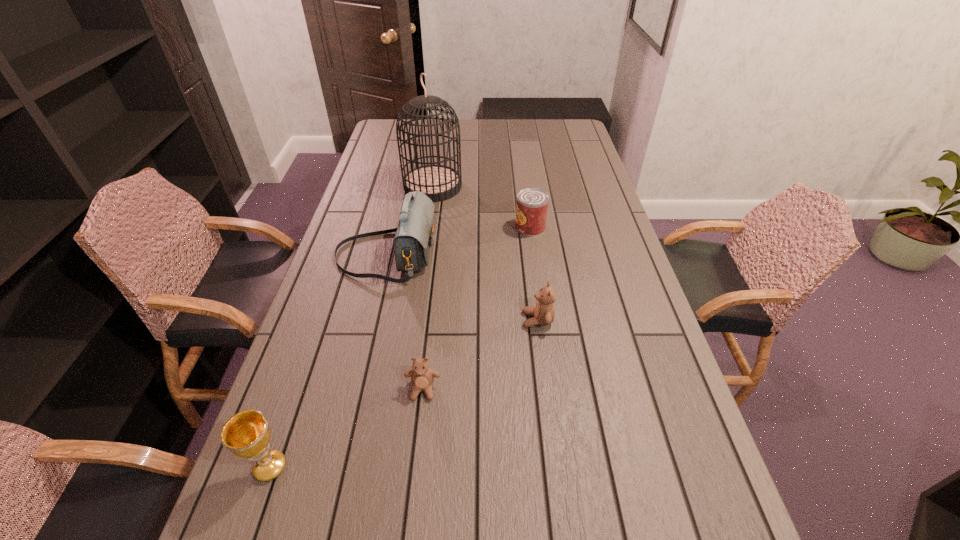
Where is `chalice positioned at the left edge`? This screenshot has height=540, width=960. chalice positioned at the left edge is located at coordinates (247, 434).

You are a GUI agent. You are given a task and a screenshot of the screen. Output one action in this format:
    pyautogui.click(x=<x>, y=<y>)
    Task: Click on the object at the near left corner
    The width and height of the screenshot is (960, 540).
    Given the screenshot: What is the action you would take?
    pyautogui.click(x=247, y=434)

This screenshot has height=540, width=960. In order to click on vacant space at the far edge in this screenshot , I will do `click(463, 125)`.

The width and height of the screenshot is (960, 540). Find the location of `blank space at the near edge`. blank space at the near edge is located at coordinates (546, 473).

In the image, there is a desktop. Identify the location of vacant space at the left edge. This screenshot has width=960, height=540. (362, 187).

Find the location of a particular element. free location at the right edge of the desktop is located at coordinates (688, 457).

At what (x,y) coordinates should I click in order to perform the action: click on free spot between the fifth shortest object and the third tallest object. Please return your answer as a coordinate pair (x, y). The image size is (960, 540). Looking at the image, I should click on (328, 361).

Identify the location of empty space that is in between the shoulder bag and the nearer teddy bear. The width and height of the screenshot is (960, 540). (404, 322).

In order to click on vacant space in between the fourth shortest object and the can in this screenshot , I will do `click(400, 347)`.

The image size is (960, 540). I want to click on free space that is in between the left teddy bear and the birdcage, so pos(428,288).